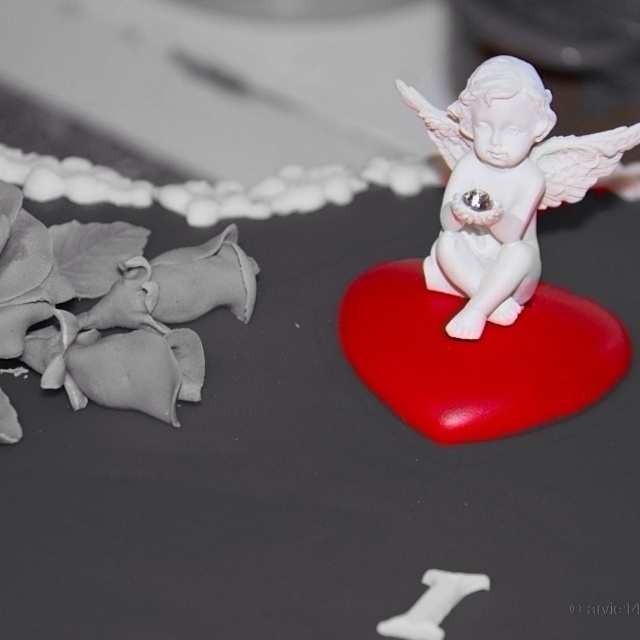
Question: Does matte gray petals at left appear on the right side of white glossy cherub at center right?

Choices:
 (A) no
 (B) yes

Answer: (A)

Question: In this image, where is matte gray petals at left located relative to white glossy cherub at center right?

Choices:
 (A) right
 (B) left

Answer: (B)

Question: Among these objects, which one is farthest from the camera?

Choices:
 (A) white glossy cherub at center right
 (B) matte gray petals at left

Answer: (A)

Question: Can you confirm if matte gray petals at left is positioned below white glossy cherub at center right?

Choices:
 (A) no
 (B) yes

Answer: (B)

Question: Among these objects, which one is farthest from the camera?

Choices:
 (A) white glossy cherub at center right
 (B) matte gray petals at left

Answer: (A)